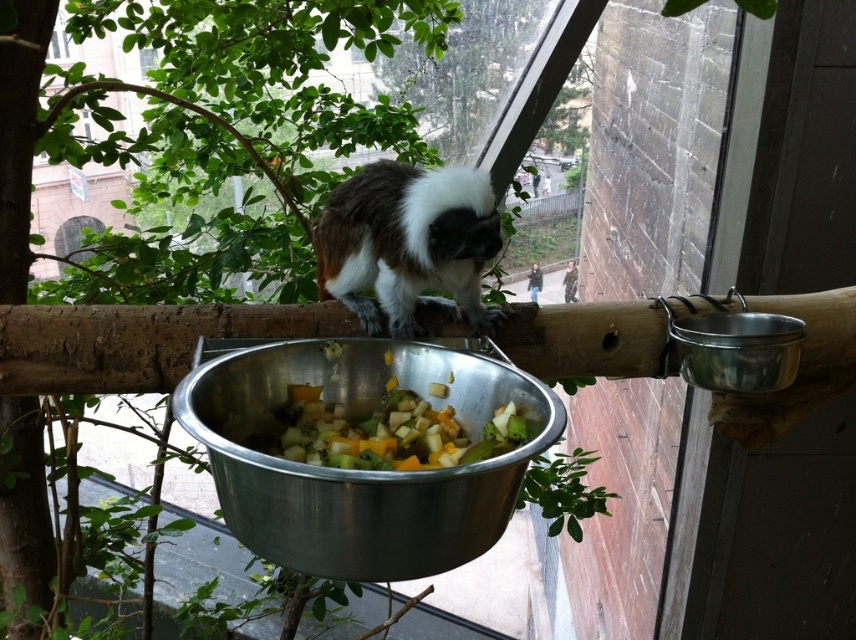
Is fluffy white monkey at center thinner than metallic silver bowl at upper right?

In fact, fluffy white monkey at center might be wider than metallic silver bowl at upper right.

Does point (453, 230) come closer to viewer compared to point (716, 344)?

Yes, point (453, 230) is closer to viewer.

I want to click on fluffy white monkey at center, so click(407, 243).

Can you confirm if multicolored diced vegetables at center is positioned below metallic silver bowl at upper right?

Yes, multicolored diced vegetables at center is below metallic silver bowl at upper right.

Is multicolored diced vegetables at center to the left of metallic silver bowl at upper right from the viewer's perspective?

Correct, you'll find multicolored diced vegetables at center to the left of metallic silver bowl at upper right.

The image size is (856, 640). I want to click on multicolored diced vegetables at center, so click(391, 433).

Is metallic silver bowl at center positioned before metallic silver bowl at upper right?

Yes, metallic silver bowl at center is in front of metallic silver bowl at upper right.

Which is below, metallic silver bowl at center or metallic silver bowl at upper right?

metallic silver bowl at center is below.

Who is more distant from viewer, (358,486) or (700,384)?

The point (700,384) is more distant.

What are the coordinates of `metallic silver bowl at center` in the screenshot? It's located at (360, 468).